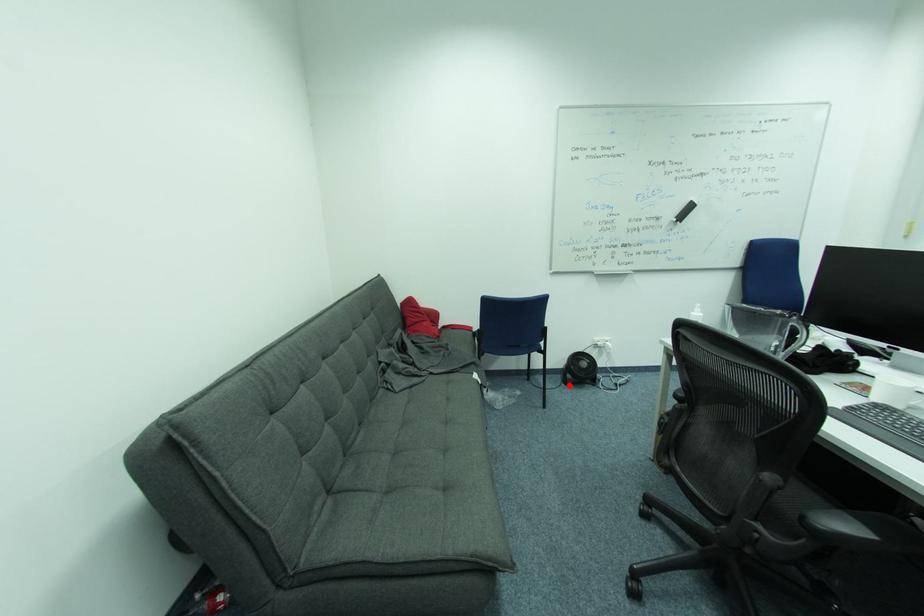
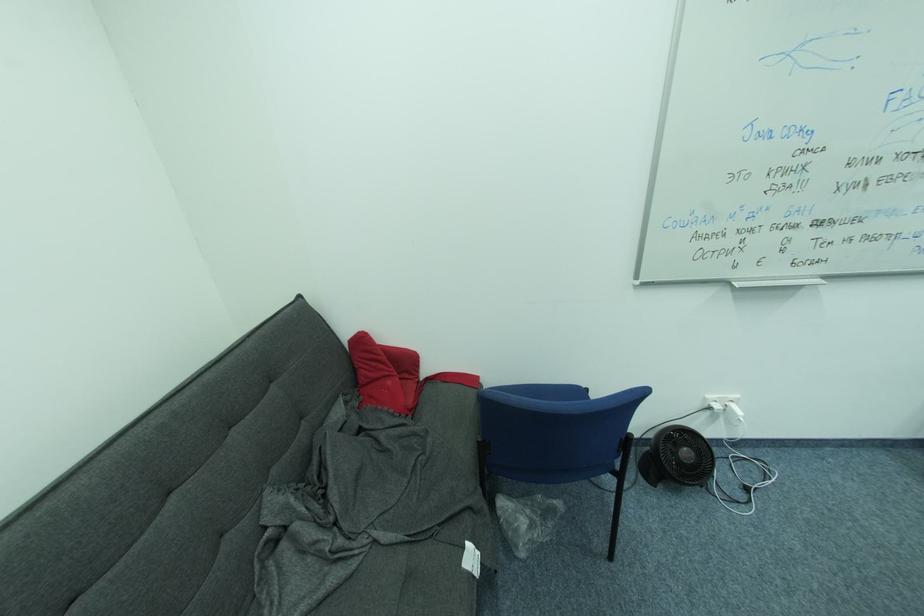
Question: A red point is marked in image1. In image2, is the corresponding 3D point closer to the camera or farther? Reply with the corresponding letter.

Choices:
 (A) The corresponding 3D point is closer.
 (B) The corresponding 3D point is farther.

Answer: (A)